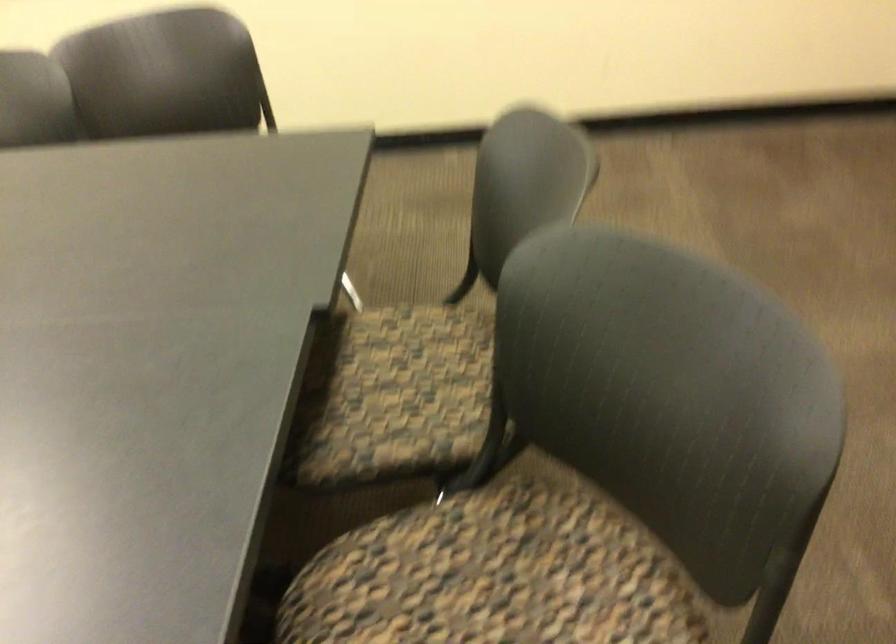
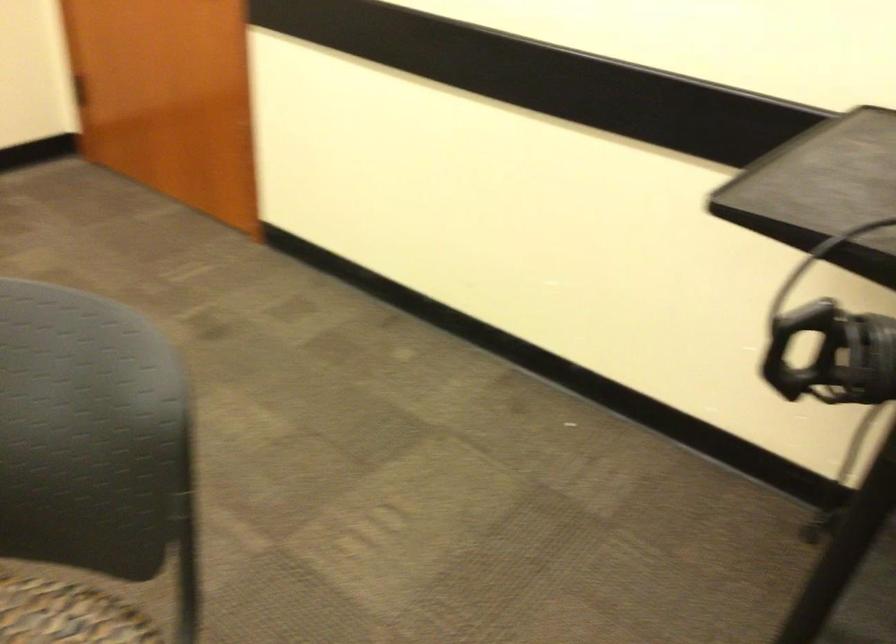
Question: The first image is from the beginning of the video and the second image is from the end. How did the camera likely rotate when shooting the video?

Choices:
 (A) Left
 (B) Right
 (C) Up
 (D) Down

Answer: (B)